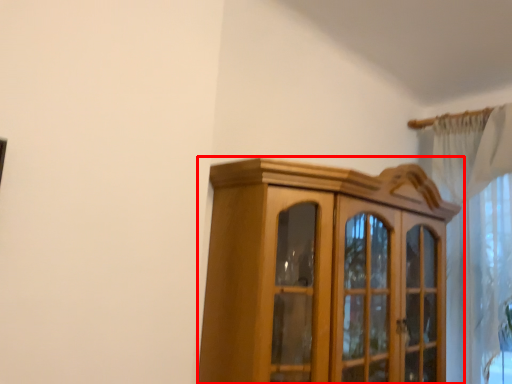
Question: From the image's perspective, what is the correct spatial relationship of cupboard (annotated by the red box) in relation to curtain?

Choices:
 (A) below
 (B) above

Answer: (A)